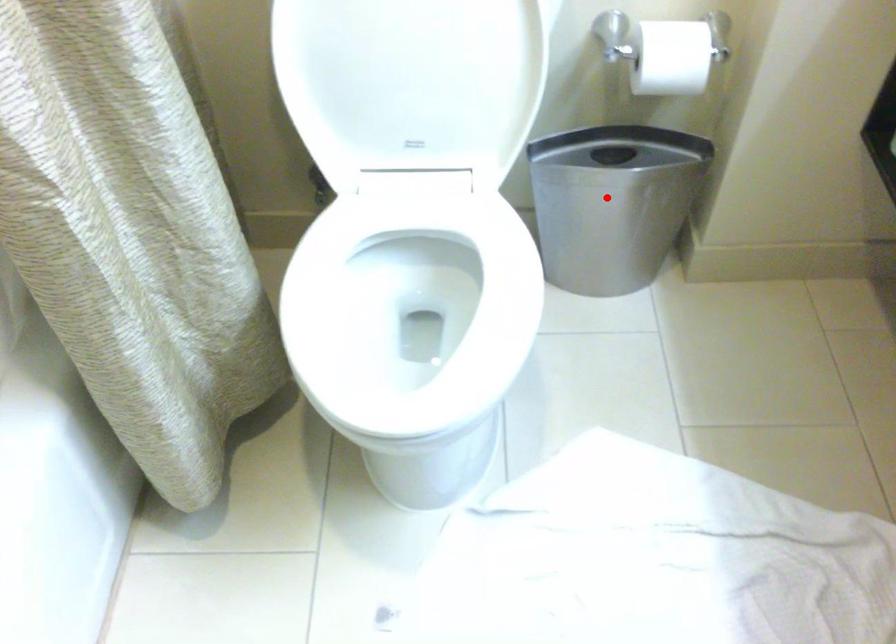
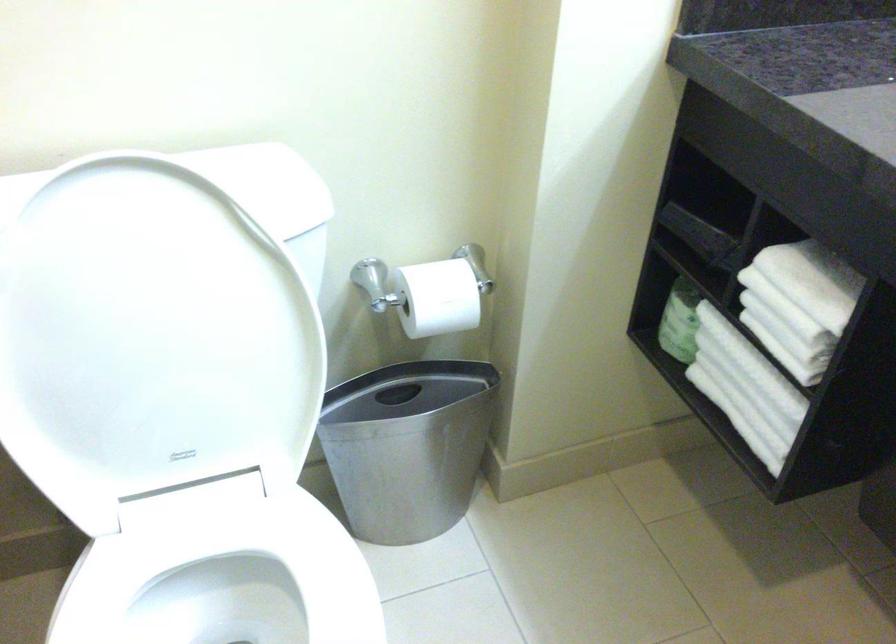
Locate, in the second image, the point that corresponds to the highlighted location in the first image.

(408, 446)